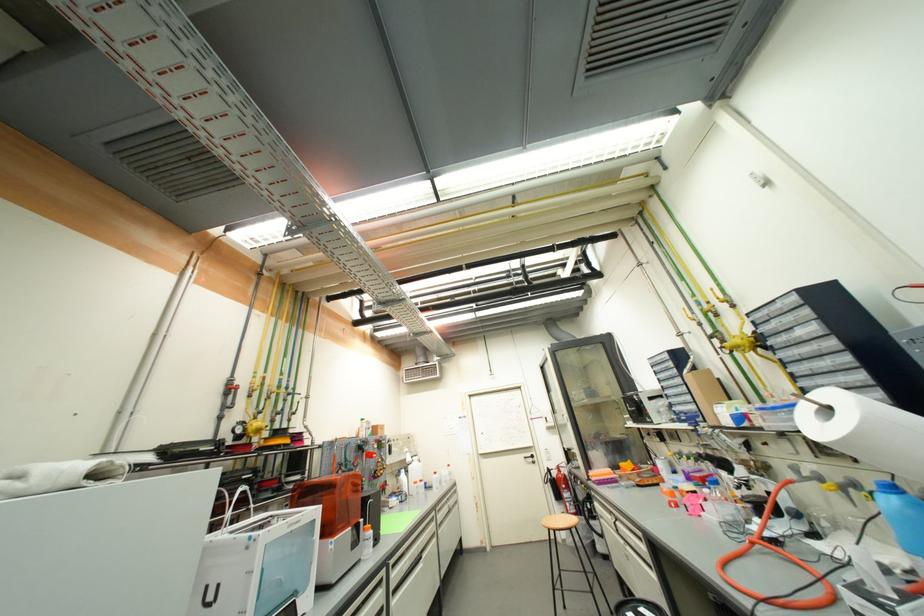
Where would you lift the blue squeeze bottle? Please return your answer as a coordinate pair (x, y).

(902, 515)